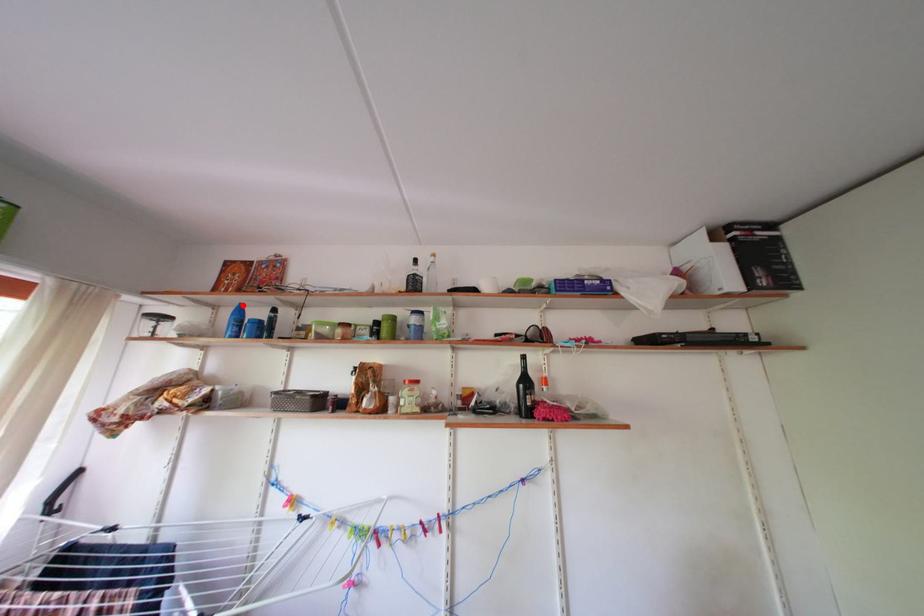
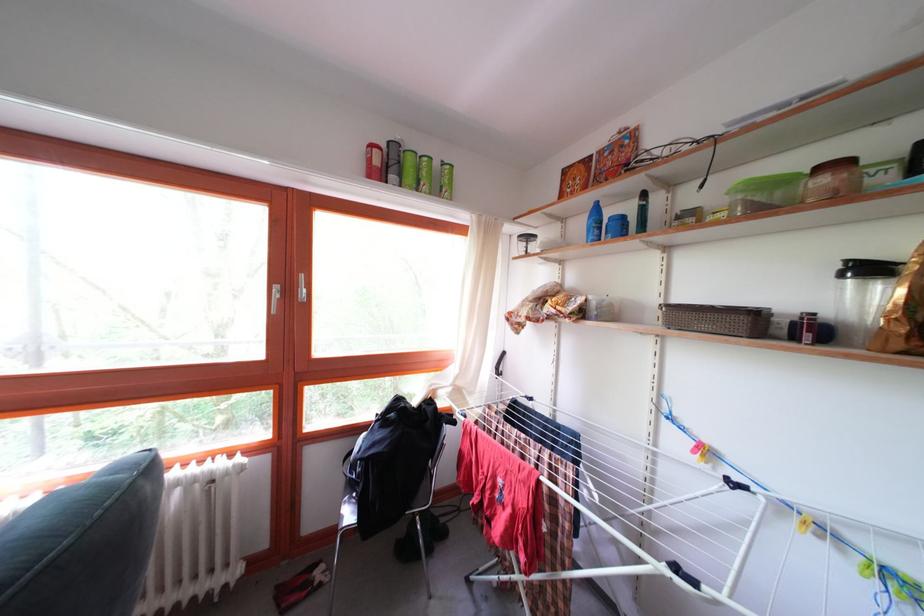
Locate, in the second image, the point that corresponds to the highlighted location in the first image.

(598, 204)